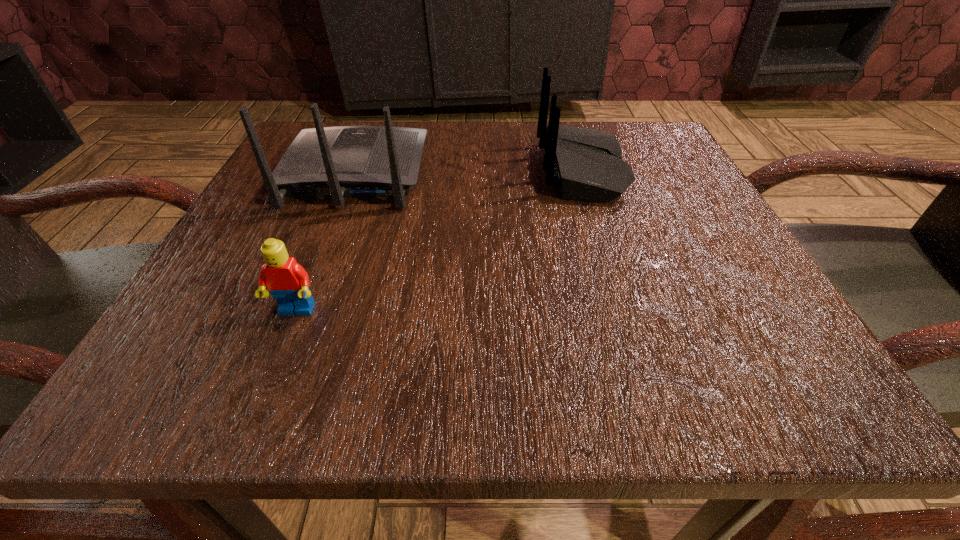
You are a GUI agent. You are given a task and a screenshot of the screen. Output one action in this format:
    pyautogui.click(x=<x>, y=<y>)
    Task: Click on the free space that is in between the Lego and the left router
    The width and height of the screenshot is (960, 540).
    Given the screenshot: What is the action you would take?
    pyautogui.click(x=325, y=242)

At what (x,y) coordinates should I click in order to perform the action: click on unoccupied position between the left router and the right router. Please return your answer as a coordinate pair (x, y). The height and width of the screenshot is (540, 960). Looking at the image, I should click on (468, 172).

This screenshot has height=540, width=960. I want to click on the closest object to the rightmost object, so click(x=345, y=161).

You are a GUI agent. You are given a task and a screenshot of the screen. Output one action in this format:
    pyautogui.click(x=<x>, y=<y>)
    Task: Click on the object that is the closest to the shortest object
    The height and width of the screenshot is (540, 960).
    Given the screenshot: What is the action you would take?
    pyautogui.click(x=345, y=161)

You are a GUI agent. You are given a task and a screenshot of the screen. Output one action in this format:
    pyautogui.click(x=<x>, y=<y>)
    Task: Click on the free space that satisfies the following two spatial constraints: 1. on the back of the rightmost object; 2. on the face of the shortest object
    
    Given the screenshot: What is the action you would take?
    pyautogui.click(x=627, y=312)